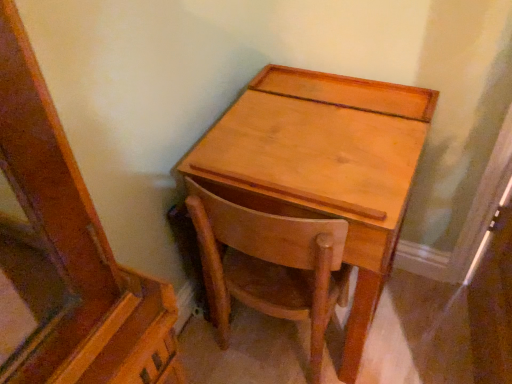
Image resolution: width=512 pixels, height=384 pixels. What do you see at coordinates (269, 265) in the screenshot?
I see `light brown wood chair at center` at bounding box center [269, 265].

The width and height of the screenshot is (512, 384). In order to click on light brown wood chair at center in this screenshot , I will do `click(269, 265)`.

Image resolution: width=512 pixels, height=384 pixels. What are the coordinates of `light brown wood desk at center` in the screenshot? It's located at tap(323, 166).

Describe the element at coordinates (323, 166) in the screenshot. The image size is (512, 384). I see `light brown wood desk at center` at that location.

Locate an element on the screen. Image resolution: width=512 pixels, height=384 pixels. light brown wood chair at center is located at coordinates (269, 265).

Considering the relative positions of light brown wood chair at center and light brown wood desk at center in the image provided, is light brown wood chair at center to the right of light brown wood desk at center from the viewer's perspective?

No, light brown wood chair at center is not to the right of light brown wood desk at center.

Consider the image. In the image, is light brown wood chair at center positioned in front of or behind light brown wood desk at center?

light brown wood chair at center is behind light brown wood desk at center.

Considering the positions of points (280, 286) and (336, 80), is point (280, 286) closer to camera compared to point (336, 80)?

Yes.

Looking at this image, from the image's perspective, which is below, light brown wood chair at center or light brown wood desk at center?

From the image's view, light brown wood chair at center is below.

From a real-world perspective, which object rests below the other?

light brown wood chair at center.

Considering the relative sizes of light brown wood chair at center and light brown wood desk at center in the image provided, is light brown wood chair at center thinner than light brown wood desk at center?

Yes, light brown wood chair at center is thinner than light brown wood desk at center.

Who is shorter, light brown wood chair at center or light brown wood desk at center?

With less height is light brown wood chair at center.

Who is smaller, light brown wood chair at center or light brown wood desk at center?

light brown wood chair at center is smaller.

Do you think light brown wood chair at center is within light brown wood desk at center, or outside of it?

light brown wood chair at center is inside light brown wood desk at center.

Would you consider light brown wood chair at center to be distant from light brown wood desk at center?

No, there isn't a large distance between light brown wood chair at center and light brown wood desk at center.

Is light brown wood chair at center oriented towards light brown wood desk at center?

Yes, light brown wood chair at center is oriented towards light brown wood desk at center.

The width and height of the screenshot is (512, 384). In order to click on chair that appears on the left of light brown wood desk at center in this screenshot , I will do `click(269, 265)`.

Does light brown wood desk at center appear on the left side of light brown wood chair at center?

No.

Is light brown wood desk at center closer to camera compared to light brown wood chair at center?

Yes, it is.

Which is behind, point (407, 163) or point (226, 313)?

The point (226, 313) is farther.

From the image's perspective, is light brown wood desk at center on light brown wood chair at center?

Yes.

From a real-world perspective, who is located lower, light brown wood desk at center or light brown wood chair at center?

From a 3D spatial view, light brown wood chair at center is below.

Considering the sizes of light brown wood desk at center and light brown wood chair at center in the image, is light brown wood desk at center wider or thinner than light brown wood chair at center?

In the image, light brown wood desk at center appears to be wider than light brown wood chair at center.

Which of these two, light brown wood desk at center or light brown wood chair at center, stands taller?

With more height is light brown wood desk at center.

Consider the image. Considering the sizes of light brown wood desk at center and light brown wood chair at center in the image, is light brown wood desk at center bigger or smaller than light brown wood chair at center?

In the image, light brown wood desk at center appears to be larger than light brown wood chair at center.

Consider the image. Is light brown wood desk at center situated inside light brown wood chair at center or outside?

light brown wood desk at center is contained in light brown wood chair at center.

Are light brown wood desk at center and light brown wood chair at center located far from each other?

No.

Is light brown wood desk at center oriented away from light brown wood chair at center?

Yes, light brown wood desk at center's orientation is away from light brown wood chair at center.

Image resolution: width=512 pixels, height=384 pixels. In order to click on desk above the light brown wood chair at center (from the image's perspective) in this screenshot , I will do `click(323, 166)`.

Image resolution: width=512 pixels, height=384 pixels. Find the location of `chair behind the light brown wood desk at center`. chair behind the light brown wood desk at center is located at coordinates (269, 265).

Where is `chair below the light brown wood desk at center (from a real-world perspective)`? chair below the light brown wood desk at center (from a real-world perspective) is located at coordinates (269, 265).